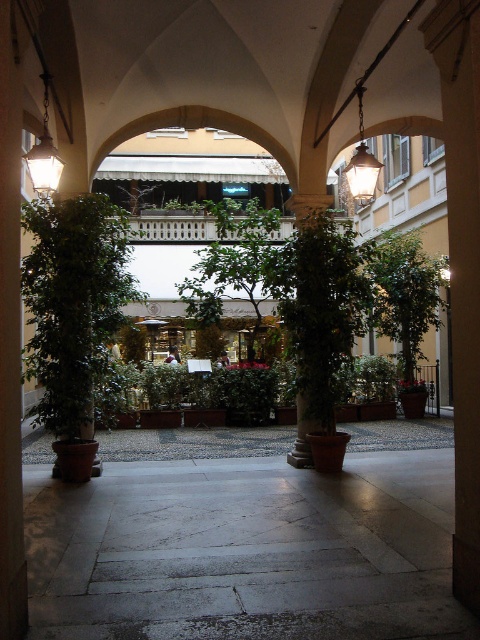
You are standing in the courtyard and want to reach a specific point marked at coordinates point (192, 292). If your current position is 50 feet away from this point, how much closer do you need to move to reach it?

The distance of point (192, 292) from viewer is 47.40 feet. Therefore, you need to move 2.6 feet closer to reach the point.

You are planning to place a new bench in the courtyard. The bench is as wide as the matte brass lantern at upper center. Can you fit it between the green leafy tree at center and the nearest potted plant without the bench overlapping with either?

The green leafy tree at center is wider than the matte brass lantern at upper center. Since the bench is as wide as the lantern, there should be enough space between the tree and the potted plant to place the bench without overlapping.